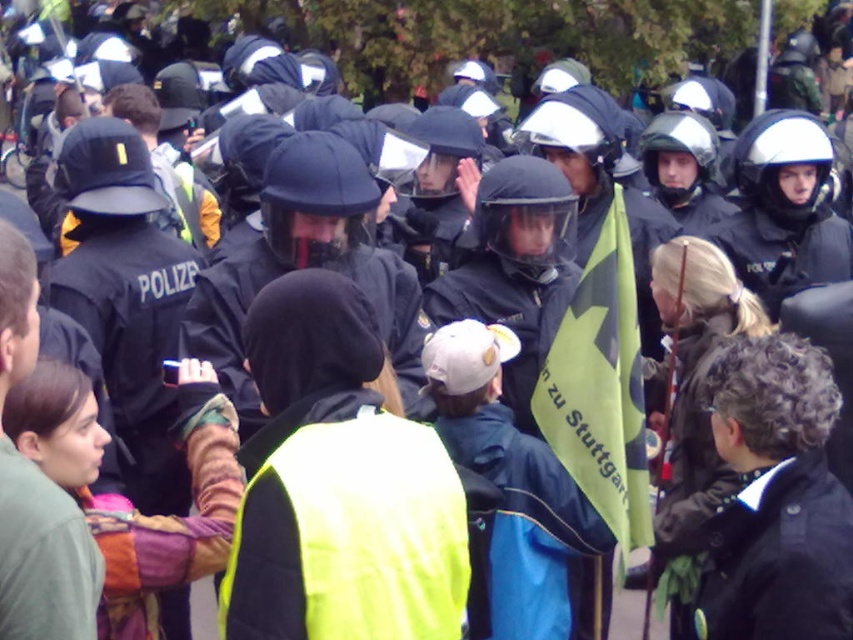
Question: Estimate the real-world distances between objects in this image. Which object is farther from the bright yellow reflective vest at center?

Choices:
 (A) black leather jacket at lower right
 (B) green fabric flag at center

Answer: (B)

Question: Which point is closer to the camera?

Choices:
 (A) (589, 296)
 (B) (328, 452)
 (C) (824, 515)

Answer: (B)

Question: Is bright yellow reflective vest at center to the right of green fabric flag at center from the viewer's perspective?

Choices:
 (A) yes
 (B) no

Answer: (B)

Question: Which point is closer to the camera?

Choices:
 (A) click(x=813, y=356)
 (B) click(x=306, y=348)
 (C) click(x=590, y=320)

Answer: (B)

Question: Observing the image, what is the correct spatial positioning of bright yellow reflective vest at center in reference to black leather jacket at lower right?

Choices:
 (A) above
 (B) below

Answer: (A)

Question: Can you confirm if bright yellow reflective vest at center is wider than black leather jacket at lower right?

Choices:
 (A) no
 (B) yes

Answer: (B)